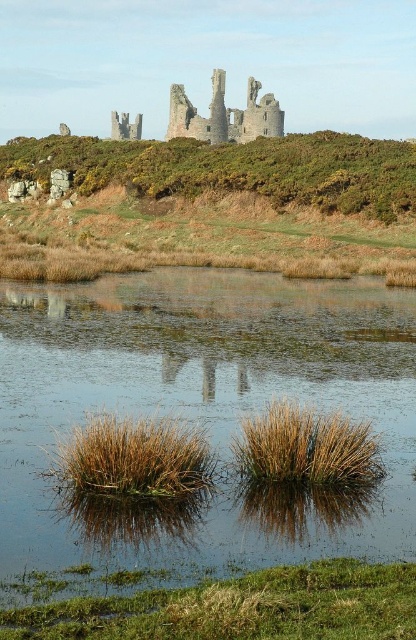
Does brown grassy water at center have a greater height compared to brown grass at lower center?

Indeed, brown grassy water at center has a greater height compared to brown grass at lower center.

Looking at this image, who is more distant from viewer, [76,321] or [175,433]?

Point [76,321]

Locate an element on the screen. brown grassy water at center is located at coordinates (202, 413).

Does brown grass at center appear on the right side of rustic stone castle at upper center?

Indeed, brown grass at center is positioned on the right side of rustic stone castle at upper center.

Does point (346, 420) come behind point (198, 132)?

No, it is in front of (198, 132).

I want to click on brown grass at center, so click(x=307, y=448).

Which is behind, point (99, 464) or point (260, 129)?

Point (260, 129)

Who is lower down, brown grass at lower center or rustic stone castle at upper center?

brown grass at lower center

Does point (129, 490) lie behind point (235, 131)?

No, it is in front of (235, 131).

This screenshot has height=640, width=416. In order to click on brown grass at lower center in this screenshot , I will do `click(135, 458)`.